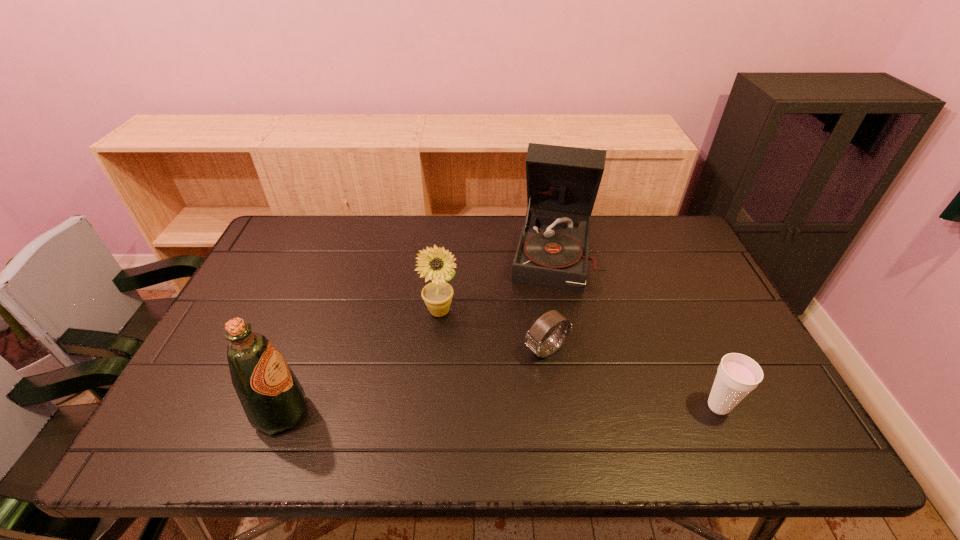
Where is `olive oil`? The width and height of the screenshot is (960, 540). olive oil is located at coordinates (273, 399).

The width and height of the screenshot is (960, 540). Identify the location of the second tallest object. (273, 399).

Locate an element on the screen. Image resolution: width=960 pixels, height=540 pixels. the rightmost object is located at coordinates (737, 375).

Find the location of `cup`. cup is located at coordinates (737, 375).

At what (x,y) coordinates should I click in order to perform the action: click on the fourth object from right to left. Please return your answer as a coordinate pair (x, y). The image size is (960, 540). Looking at the image, I should click on [435, 264].

Find the location of a particular element. The image size is (960, 540). sunflower is located at coordinates (435, 264).

You are a GUI agent. You are given a task and a screenshot of the screen. Output one action in this format:
    pyautogui.click(x=<x>, y=<y>)
    Task: Click on the third nearest object
    
    Given the screenshot: What is the action you would take?
    pyautogui.click(x=533, y=340)

At what (x,y) coordinates should I click in order to perform the action: click on watch. Please return your answer as a coordinate pair (x, y). Looking at the image, I should click on (533, 340).

This screenshot has width=960, height=540. Identify the location of the tallest object. (562, 182).

Locate an element on the screen. phonograph_record is located at coordinates (562, 182).